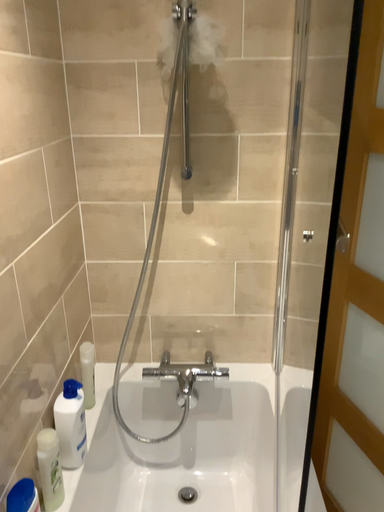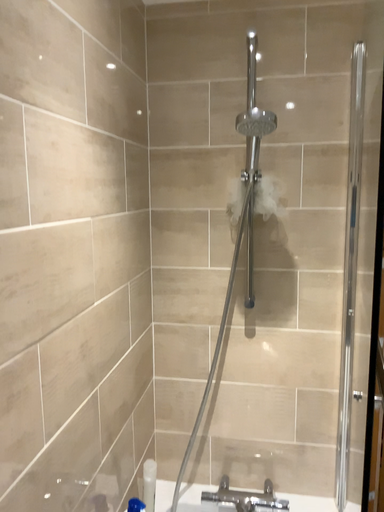
Question: How did the camera likely rotate when shooting the video?

Choices:
 (A) rotated left
 (B) rotated right

Answer: (A)